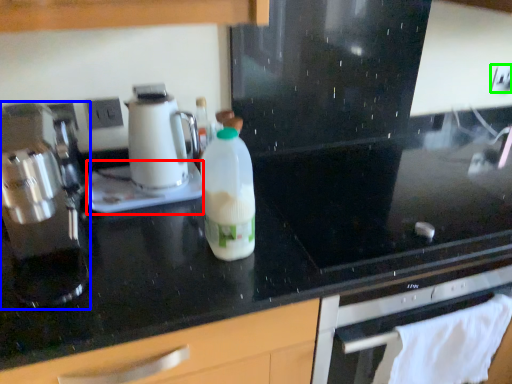
Question: Which is nearer to the appliance (highlighted by a red box)? kitchen appliance (highlighted by a blue box) or electric outlet (highlighted by a green box).

Choices:
 (A) kitchen appliance
 (B) electric outlet

Answer: (A)